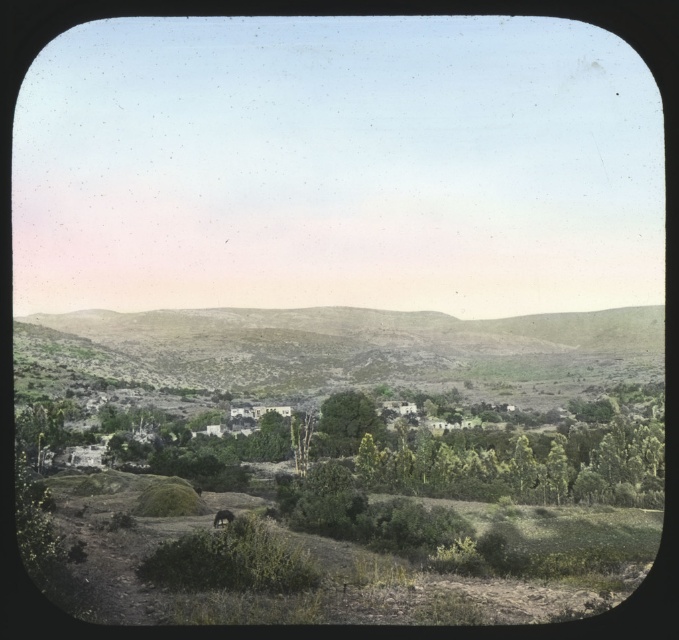
Question: Which object appears closest to the camera in this image?

Choices:
 (A) green grassy hillside at center
 (B) brown furry dog at lower center
 (C) green leafy tree at center

Answer: (B)

Question: Considering the relative positions of green grassy hillside at center and brown furry dog at lower center in the image provided, where is green grassy hillside at center located with respect to brown furry dog at lower center?

Choices:
 (A) above
 (B) below

Answer: (A)

Question: Does green grassy hillside at center have a lesser width compared to brown furry dog at lower center?

Choices:
 (A) no
 (B) yes

Answer: (A)

Question: Does green grassy hillside at center have a greater width compared to brown furry dog at lower center?

Choices:
 (A) no
 (B) yes

Answer: (B)

Question: Which point appears farthest from the camera in this image?

Choices:
 (A) (232, 518)
 (B) (344, 404)

Answer: (B)

Question: Which point is farther to the camera?

Choices:
 (A) green leafy tree at center
 (B) brown furry dog at lower center

Answer: (A)